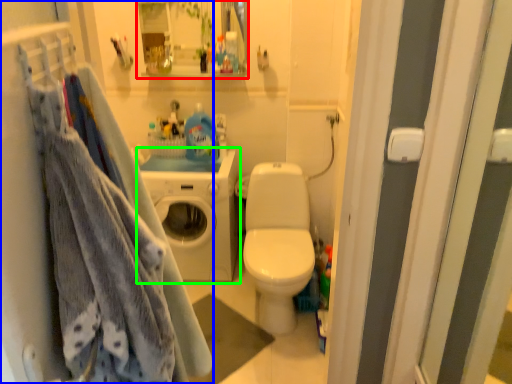
Question: Based on their relative distances, which object is farther from cabinet (highlighted by a red box)? Choose from closet (highlighted by a blue box) and washing machine (highlighted by a green box).

Choices:
 (A) closet
 (B) washing machine

Answer: (A)